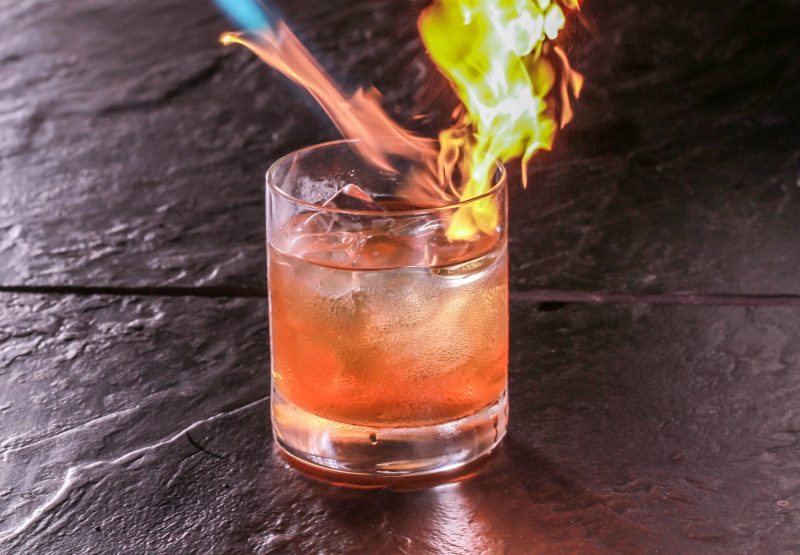
Find the location of `glass`. glass is located at coordinates (454, 379).